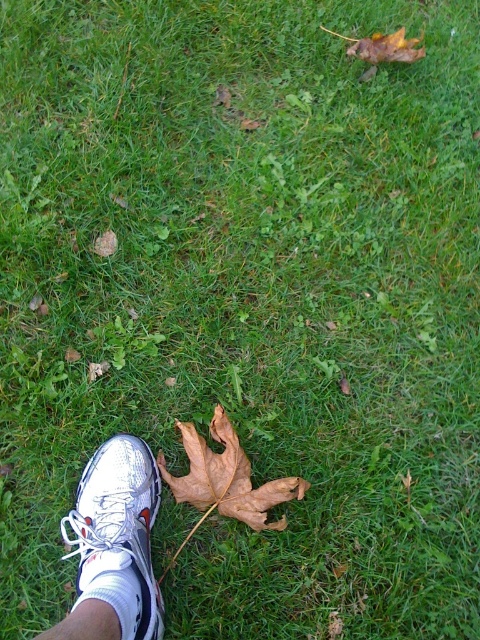
Question: In this image, where is white mesh shoe at lower left located relative to brown papery maple leaf at lower center?

Choices:
 (A) below
 (B) above

Answer: (A)

Question: Which of the following is the farthest from the observer?

Choices:
 (A) (79, 595)
 (B) (165, 464)

Answer: (B)

Question: Which object appears farthest from the camera in this image?

Choices:
 (A) white mesh shoe at lower left
 (B) brown papery maple leaf at lower center

Answer: (B)

Question: Which point is farther to the camera?

Choices:
 (A) (137, 620)
 (B) (262, 506)

Answer: (B)

Question: Observing the image, what is the correct spatial positioning of white mesh shoe at lower left in reference to brown papery maple leaf at lower center?

Choices:
 (A) below
 (B) above

Answer: (A)

Question: Is white mesh shoe at lower left smaller than brown papery maple leaf at lower center?

Choices:
 (A) yes
 (B) no

Answer: (B)